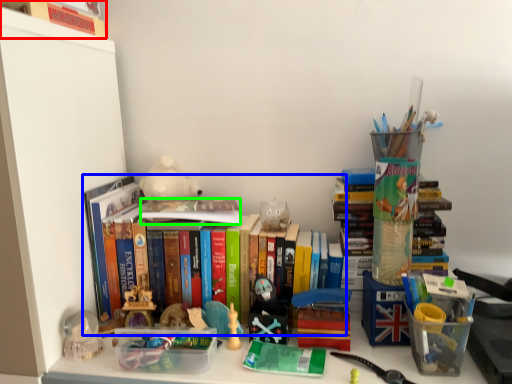
Question: Considering the real-world distances, which object is closest to book (highlighted by a red box)? book (highlighted by a blue box) or book (highlighted by a green box).

Choices:
 (A) book
 (B) book

Answer: (A)